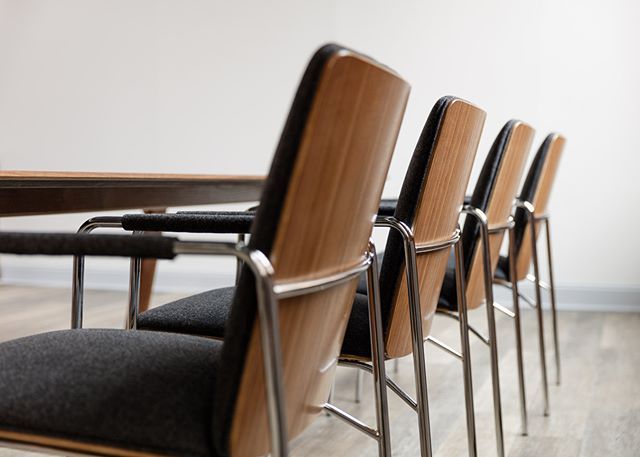
The image size is (640, 457). I want to click on chair backs, so click(320, 187), click(445, 173), click(512, 175), click(543, 175).